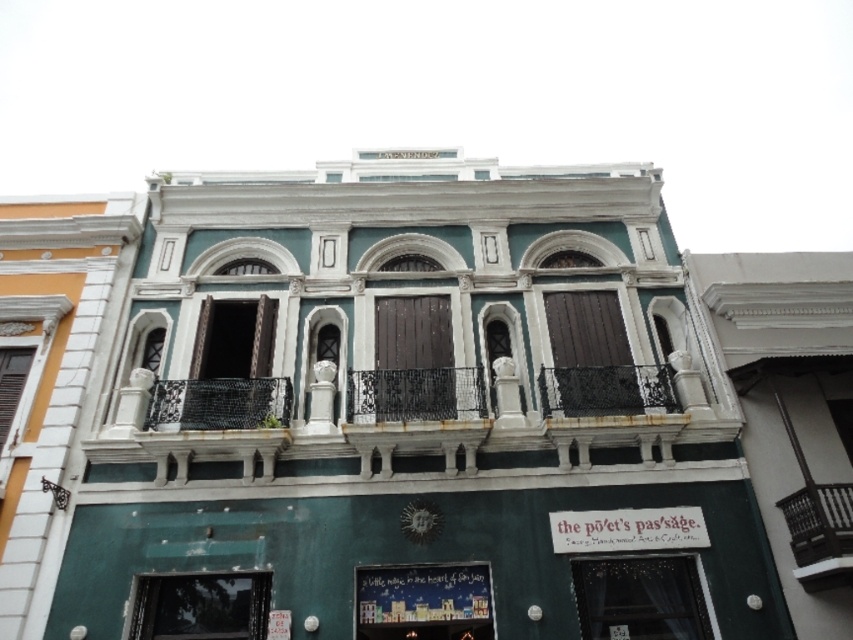
You are a delivery person trying to deliver a package to the shop. You have a large box that is 2 meters wide. Can the box fit through the matte glass window at lower left or the dark brown wrought iron balcony at center?

The matte glass window at lower left might be wider than dark brown wrought iron balcony at center, so the box might fit through the matte glass window at lower left if its width is sufficient. However, the dark brown wrought iron balcony at center is narrower and likely cannot accommodate the 2 meter wide box.